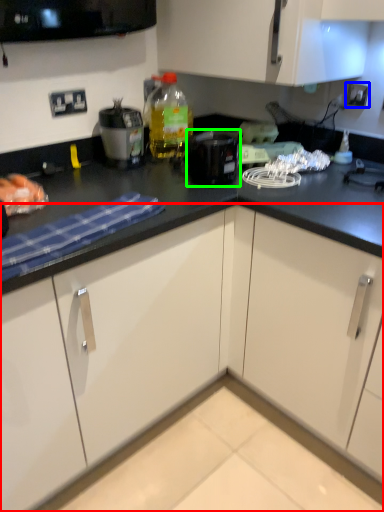
Question: Which is farther away from cabinetry (highlighted by a red box)? electric outlet (highlighted by a blue box) or kitchen appliance (highlighted by a green box)?

Choices:
 (A) electric outlet
 (B) kitchen appliance

Answer: (A)